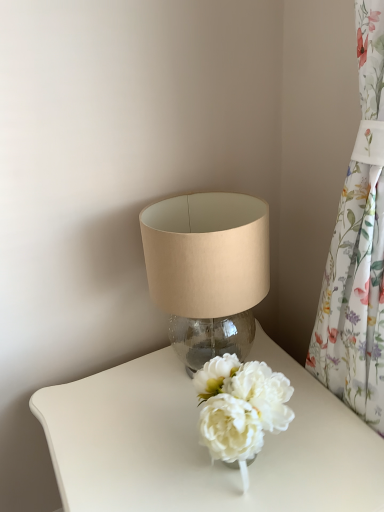
Locate an element on the screen. free location to the left of translucent glass lampshade at upper center is located at coordinates (117, 399).